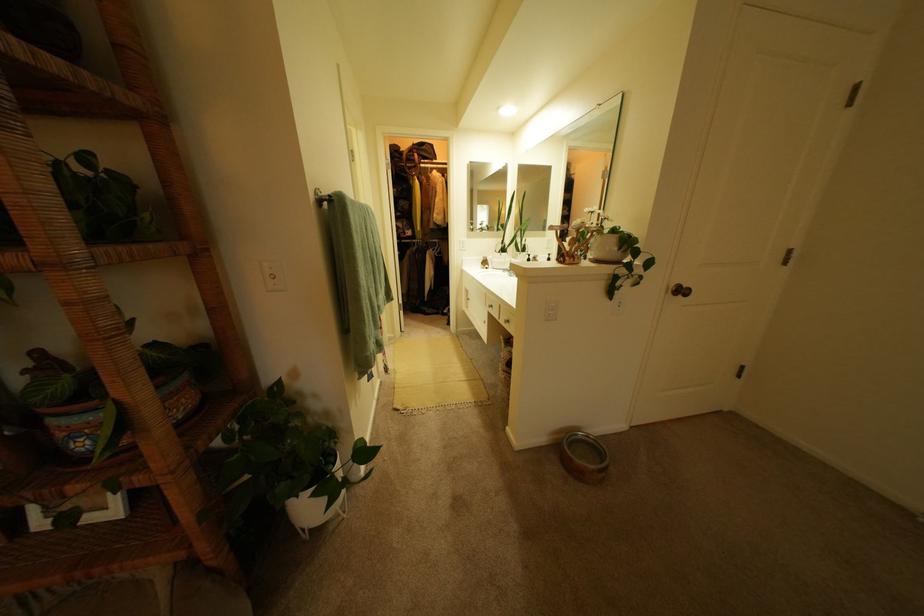
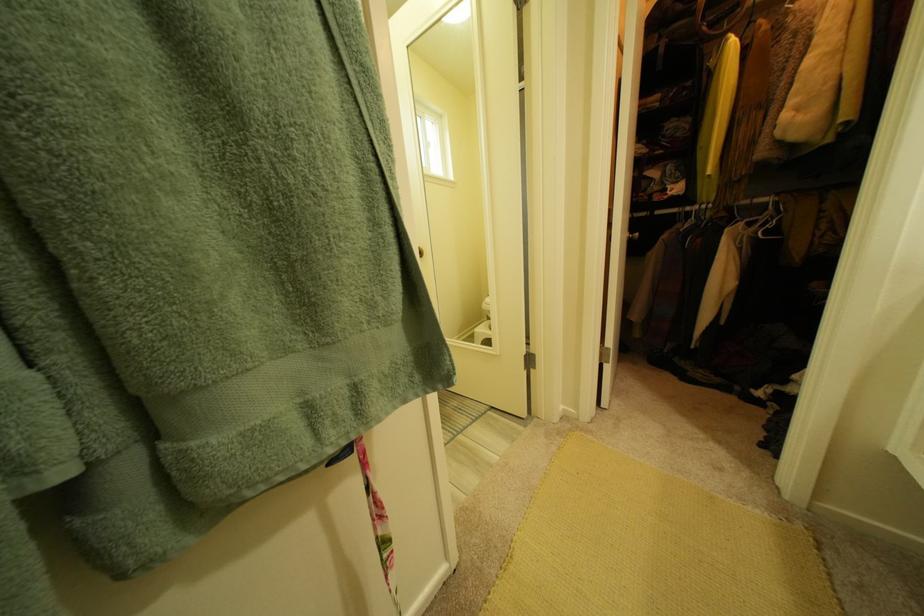
Locate, in the second image, the point that corresponds to point (451, 241) in the first image.

(777, 201)